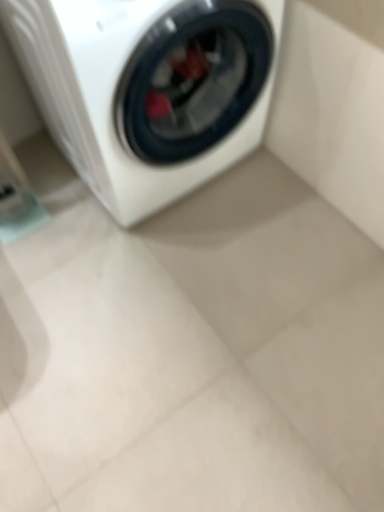
I want to click on white glossy washing machine at upper right, so click(x=144, y=90).

What do you see at coordinates (144, 90) in the screenshot? I see `white glossy washing machine at upper right` at bounding box center [144, 90].

You are a GUI agent. You are given a task and a screenshot of the screen. Output one action in this format:
    pyautogui.click(x=<x>, y=<y>)
    Task: Click on the white glossy washing machine at upper right
    The image size is (384, 512).
    Given the screenshot: What is the action you would take?
    [144, 90]